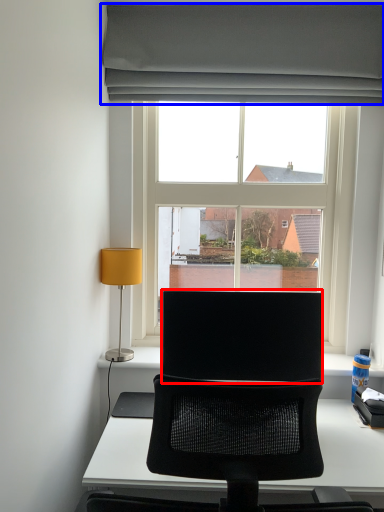
Question: Which point is further to the camera, computer monitor (highlighted by a red box) or curtain (highlighted by a blue box)?

Choices:
 (A) computer monitor
 (B) curtain

Answer: (B)